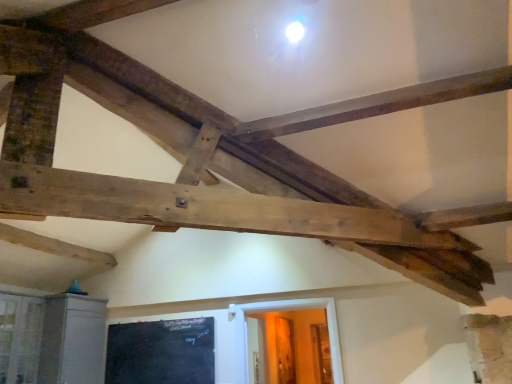
Question: Could you tell me if clear glass window at lower left is facing black chalkboard at lower left?

Choices:
 (A) no
 (B) yes

Answer: (A)

Question: From the image's perspective, would you say clear glass window at lower left is positioned over black chalkboard at lower left?

Choices:
 (A) yes
 (B) no

Answer: (A)

Question: Would you say clear glass window at lower left contains black chalkboard at lower left?

Choices:
 (A) yes
 (B) no

Answer: (B)

Question: Does clear glass window at lower left have a lesser width compared to black chalkboard at lower left?

Choices:
 (A) no
 (B) yes

Answer: (A)

Question: Is clear glass window at lower left positioned with its back to black chalkboard at lower left?

Choices:
 (A) yes
 (B) no

Answer: (B)

Question: Relative to black chalkboard at lower left, is clear glass window at lower left in front or behind?

Choices:
 (A) behind
 (B) front

Answer: (B)

Question: Visually, is clear glass window at lower left positioned to the left or to the right of black chalkboard at lower left?

Choices:
 (A) right
 (B) left

Answer: (B)

Question: Which is correct: clear glass window at lower left is inside black chalkboard at lower left, or outside of it?

Choices:
 (A) outside
 (B) inside

Answer: (A)

Question: From their relative heights in the image, would you say clear glass window at lower left is taller or shorter than black chalkboard at lower left?

Choices:
 (A) short
 (B) tall

Answer: (B)

Question: In the image, is black chalkboard at lower left on the left side or the right side of white wooden door at lower center?

Choices:
 (A) left
 (B) right

Answer: (A)

Question: Is black chalkboard at lower left inside the boundaries of white wooden door at lower center, or outside?

Choices:
 (A) outside
 (B) inside

Answer: (A)

Question: From their relative heights in the image, would you say black chalkboard at lower left is taller or shorter than white wooden door at lower center?

Choices:
 (A) tall
 (B) short

Answer: (B)

Question: From a real-world perspective, is black chalkboard at lower left physically located above or below white wooden door at lower center?

Choices:
 (A) above
 (B) below

Answer: (A)

Question: From the image's perspective, is white wooden door at lower center positioned above or below black chalkboard at lower left?

Choices:
 (A) above
 (B) below

Answer: (B)

Question: Is white wooden door at lower center taller or shorter than black chalkboard at lower left?

Choices:
 (A) tall
 (B) short

Answer: (A)